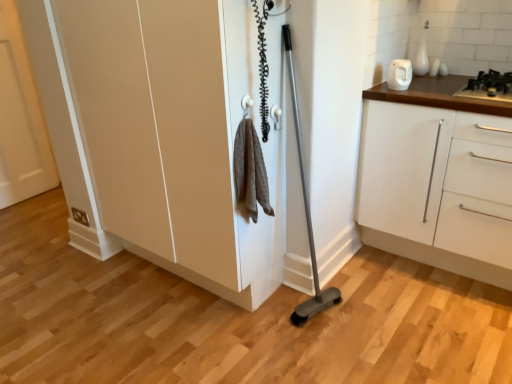
Question: Is white glossy kettle at upper right in front of white matte cabinet at right?

Choices:
 (A) no
 (B) yes

Answer: (A)

Question: Is white glossy kettle at upper right placed right next to white matte cabinet at right?

Choices:
 (A) no
 (B) yes

Answer: (A)

Question: From a real-world perspective, is white glossy kettle at upper right physically above white matte cabinet at right?

Choices:
 (A) yes
 (B) no

Answer: (A)

Question: Can you confirm if white glossy kettle at upper right is thinner than white matte cabinet at right?

Choices:
 (A) yes
 (B) no

Answer: (A)

Question: Can you confirm if white glossy kettle at upper right is positioned to the left of white matte cabinet at right?

Choices:
 (A) yes
 (B) no

Answer: (A)

Question: From the image's perspective, is matte white cupboard at center above or below white matte door at left?

Choices:
 (A) below
 (B) above

Answer: (A)

Question: In terms of height, does matte white cupboard at center look taller or shorter compared to white matte door at left?

Choices:
 (A) tall
 (B) short

Answer: (B)

Question: Is matte white cupboard at center to the left or to the right of white matte door at left in the image?

Choices:
 (A) left
 (B) right

Answer: (B)

Question: Looking at their shapes, would you say matte white cupboard at center is wider or thinner than white matte door at left?

Choices:
 (A) wide
 (B) thin

Answer: (A)

Question: From a real-world perspective, relative to white matte door at left, is white matte cabinet at right vertically above or below?

Choices:
 (A) above
 (B) below

Answer: (B)

Question: Is white matte cabinet at right to the left or to the right of white matte door at left in the image?

Choices:
 (A) left
 (B) right

Answer: (B)

Question: Considering the positions of white matte cabinet at right and white matte door at left in the image, is white matte cabinet at right wider or thinner than white matte door at left?

Choices:
 (A) thin
 (B) wide

Answer: (B)

Question: Considering their positions, is white matte cabinet at right located in front of or behind white matte door at left?

Choices:
 (A) behind
 (B) front

Answer: (B)

Question: From the image's perspective, is black metallic gas stove at upper right located above or below matte white cupboard at center?

Choices:
 (A) below
 (B) above

Answer: (B)

Question: Visually, is black metallic gas stove at upper right positioned to the left or to the right of matte white cupboard at center?

Choices:
 (A) right
 (B) left

Answer: (A)